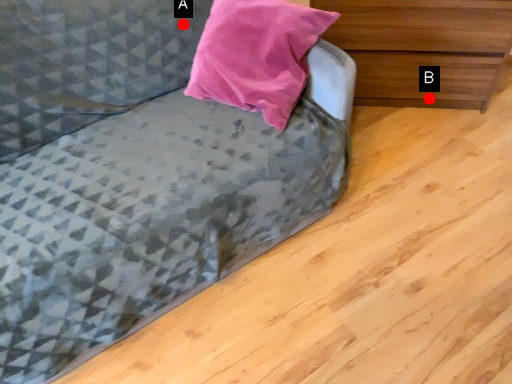
Question: Two points are circled on the image, labeled by A and B beside each circle. Which point appears closest to the camera in this image?

Choices:
 (A) A is closer
 (B) B is closer

Answer: (A)